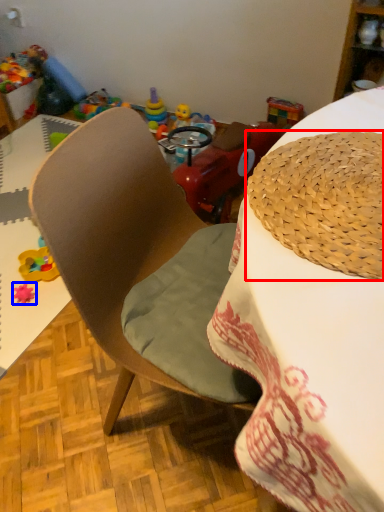
Question: Which point is further to the camera, hat (highlighted by a red box) or toy (highlighted by a blue box)?

Choices:
 (A) hat
 (B) toy

Answer: (B)